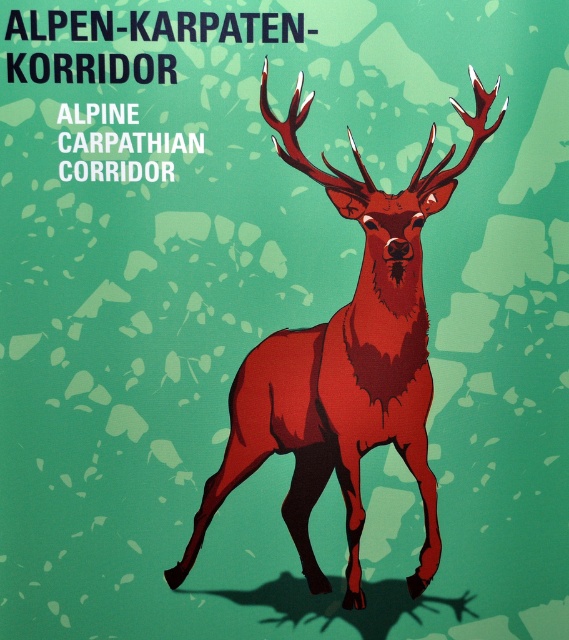
Is matte red deer at center to the left of shiny red antlers at center from the viewer's perspective?

Indeed, matte red deer at center is positioned on the left side of shiny red antlers at center.

This screenshot has width=569, height=640. What do you see at coordinates (345, 362) in the screenshot?
I see `matte red deer at center` at bounding box center [345, 362].

Find the location of `matte red deer at center`. matte red deer at center is located at coordinates (345, 362).